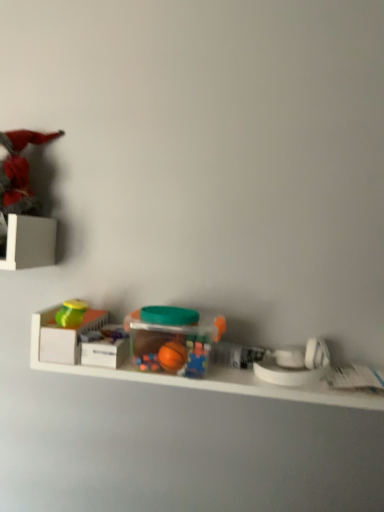
Question: Does white matte storage box at left have a greater height compared to translucent plastic container at center, which is counted as the second toy, starting from the bottom?

Choices:
 (A) yes
 (B) no

Answer: (B)

Question: Is there a large distance between white matte storage box at left and translucent plastic container at center, marked as the 2th toy in a right-to-left arrangement?

Choices:
 (A) no
 (B) yes

Answer: (A)

Question: From the image's perspective, is white matte storage box at left over translucent plastic container at center, marked as the 2th toy in a right-to-left arrangement?

Choices:
 (A) yes
 (B) no

Answer: (B)

Question: Is white matte storage box at left smaller than translucent plastic container at center, which is counted as the second toy, starting from the bottom?

Choices:
 (A) yes
 (B) no

Answer: (A)

Question: Does white matte storage box at left appear on the right side of translucent plastic container at center, marked as the 2th toy in a right-to-left arrangement?

Choices:
 (A) no
 (B) yes

Answer: (A)

Question: Is matte green lid at left, the third toy viewed from the right, in front of or behind white matte storage box at left in the image?

Choices:
 (A) front
 (B) behind

Answer: (B)

Question: Does point (81, 320) appear closer or farther from the camera than point (62, 347)?

Choices:
 (A) closer
 (B) farther

Answer: (B)

Question: From a real-world perspective, is matte green lid at left, the second toy from the top, positioned above or below white matte storage box at left?

Choices:
 (A) above
 (B) below

Answer: (A)

Question: From the image's perspective, relative to white matte storage box at left, is matte green lid at left, the second toy from the top, above or below?

Choices:
 (A) below
 (B) above

Answer: (B)

Question: Considering the positions of point (69, 318) and point (147, 352), is point (69, 318) closer or farther from the camera than point (147, 352)?

Choices:
 (A) closer
 (B) farther

Answer: (B)

Question: From the image's perspective, is matte green lid at left, the second toy from the top, above or below translucent plastic container at center, marked as the 2th toy in a right-to-left arrangement?

Choices:
 (A) below
 (B) above

Answer: (B)

Question: Considering the positions of matte green lid at left, the third toy viewed from the right, and translucent plastic container at center, the third toy in the top-to-bottom sequence, in the image, is matte green lid at left, the third toy viewed from the right, taller or shorter than translucent plastic container at center, the third toy in the top-to-bottom sequence,?

Choices:
 (A) tall
 (B) short

Answer: (B)

Question: In terms of size, does matte green lid at left, which appears as the 2th toy when viewed from the left, appear bigger or smaller than translucent plastic container at center, the third toy in the top-to-bottom sequence?

Choices:
 (A) big
 (B) small

Answer: (B)

Question: In the image, is white plastic toy at right, arranged as the first toy when ordered from the bottom, positioned in front of or behind matte green lid at left, the second toy from the top?

Choices:
 (A) front
 (B) behind

Answer: (A)

Question: Visually, is white plastic toy at right, placed as the fourth toy when sorted from left to right, positioned to the left or to the right of matte green lid at left, arranged as the 3th toy when ordered from the bottom?

Choices:
 (A) left
 (B) right

Answer: (B)